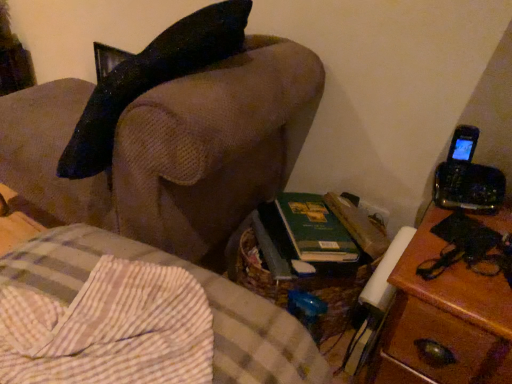
Question: Is the position of wooden nightstand at right more distant than that of brown fabric couch at upper left, the second furniture in the bottom-to-top sequence?

Choices:
 (A) yes
 (B) no

Answer: (A)

Question: Is wooden nightstand at right positioned before brown fabric couch at upper left, the second furniture in the bottom-to-top sequence?

Choices:
 (A) no
 (B) yes

Answer: (A)

Question: Is wooden nightstand at right to the right of brown fabric couch at upper left, the second furniture in the bottom-to-top sequence, from the viewer's perspective?

Choices:
 (A) yes
 (B) no

Answer: (A)

Question: Considering the relative sizes of wooden nightstand at right and brown fabric couch at upper left, the second furniture in the bottom-to-top sequence, in the image provided, is wooden nightstand at right shorter than brown fabric couch at upper left, the second furniture in the bottom-to-top sequence,?

Choices:
 (A) no
 (B) yes

Answer: (B)

Question: Is wooden nightstand at right facing away from brown fabric couch at upper left, the 1th furniture positioned from the top?

Choices:
 (A) yes
 (B) no

Answer: (B)

Question: From a real-world perspective, is wooden nightstand at right on top of brown fabric couch at upper left, the second furniture in the bottom-to-top sequence?

Choices:
 (A) yes
 (B) no

Answer: (B)

Question: Is brown fabric couch at upper left, the second furniture in the bottom-to-top sequence, at the left side of wooden nightstand at right?

Choices:
 (A) no
 (B) yes

Answer: (B)

Question: From a real-world perspective, is brown fabric couch at upper left, the 1th furniture positioned from the top, on top of wooden nightstand at right?

Choices:
 (A) no
 (B) yes

Answer: (B)

Question: From the image's perspective, is brown fabric couch at upper left, the second furniture in the bottom-to-top sequence, above wooden nightstand at right?

Choices:
 (A) yes
 (B) no

Answer: (A)

Question: Are brown fabric couch at upper left, the second furniture in the bottom-to-top sequence, and wooden nightstand at right located far from each other?

Choices:
 (A) yes
 (B) no

Answer: (B)

Question: Can we say brown fabric couch at upper left, the second furniture in the bottom-to-top sequence, lies outside wooden nightstand at right?

Choices:
 (A) yes
 (B) no

Answer: (A)

Question: Can you confirm if brown fabric couch at upper left, the second furniture in the bottom-to-top sequence, is wider than wooden nightstand at right?

Choices:
 (A) yes
 (B) no

Answer: (A)

Question: From a real-world perspective, is wooden nightstand at right located higher than brown woven basket at lower center, placed as the 1th furniture when sorted from bottom to top?

Choices:
 (A) no
 (B) yes

Answer: (B)